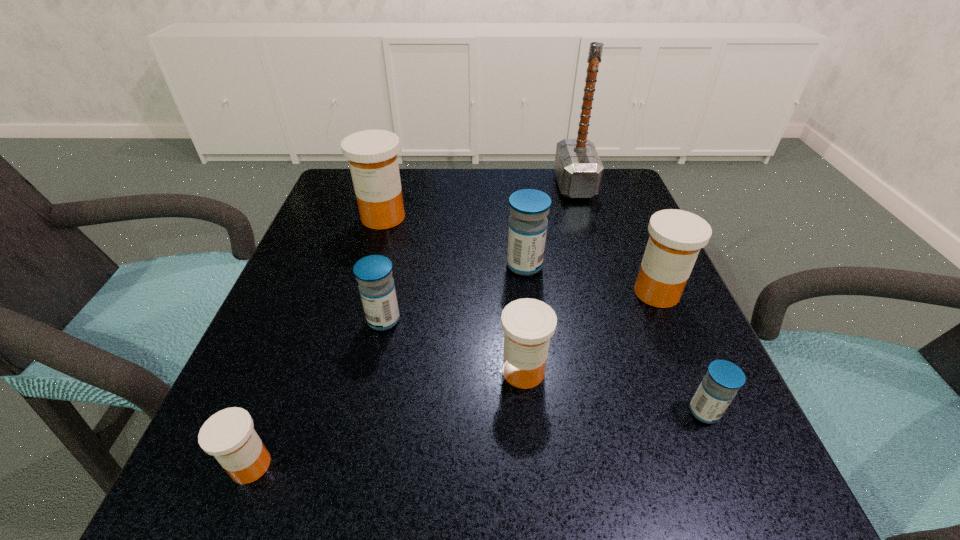
The width and height of the screenshot is (960, 540). In order to click on the second smallest orange medicine in this screenshot , I will do `click(528, 324)`.

The width and height of the screenshot is (960, 540). I want to click on the third nearest object, so click(528, 324).

Find the location of a particular element. the nearest blue medicine is located at coordinates (719, 386).

Image resolution: width=960 pixels, height=540 pixels. I want to click on the seventh farthest object, so click(719, 386).

Image resolution: width=960 pixels, height=540 pixels. Find the location of `the smallest orange medicine`. the smallest orange medicine is located at coordinates (228, 435).

Identify the location of the nearest object. This screenshot has width=960, height=540. (228, 435).

Where is `vacant space located on the striking surface of the hammer`? The image size is (960, 540). vacant space located on the striking surface of the hammer is located at coordinates (420, 185).

Find the location of a particular element. This screenshot has height=540, width=960. vacant position located 0.140m on the striking surface of the hammer is located at coordinates (500, 185).

In order to click on free point located 0.290m on the striking surface of the hammer in this screenshot , I will do `click(440, 185)`.

In order to click on vacant area located 0.140m on the label of the tallest medicine in this screenshot , I will do `click(367, 276)`.